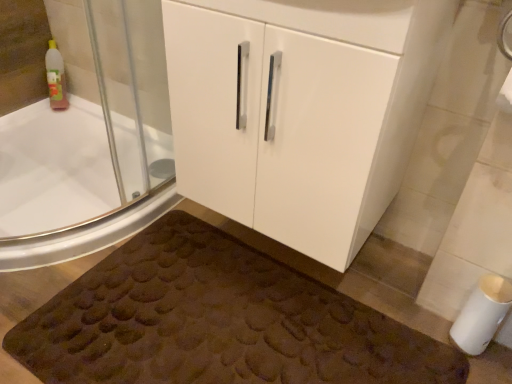
Locate an element on the screen. vacant space in white glossy bathtub at upper left (from a real-world perspective) is located at coordinates (99, 221).